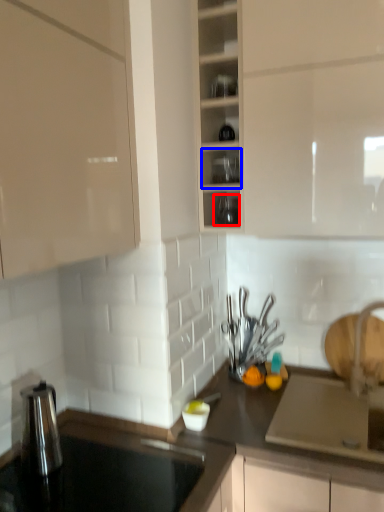
Question: Which of the following is the closest to the observer, tableware (highlighted by a red box) or shelf (highlighted by a blue box)?

Choices:
 (A) tableware
 (B) shelf

Answer: (B)